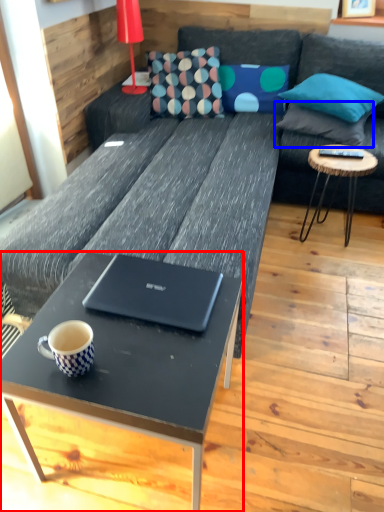
Question: Which of the following is the farthest to the observer, coffee table (highlighted by a red box) or pillow (highlighted by a blue box)?

Choices:
 (A) coffee table
 (B) pillow

Answer: (B)